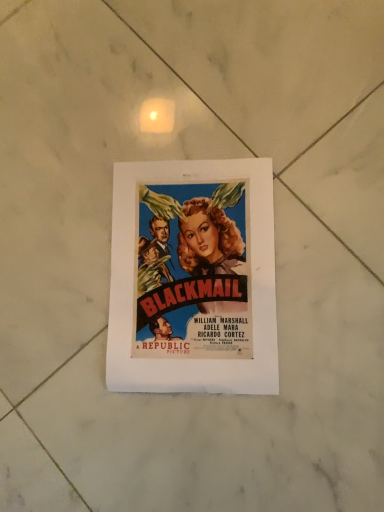
Question: Should I look upward or downward to see matte paper poster at center?

Choices:
 (A) down
 (B) up

Answer: (A)